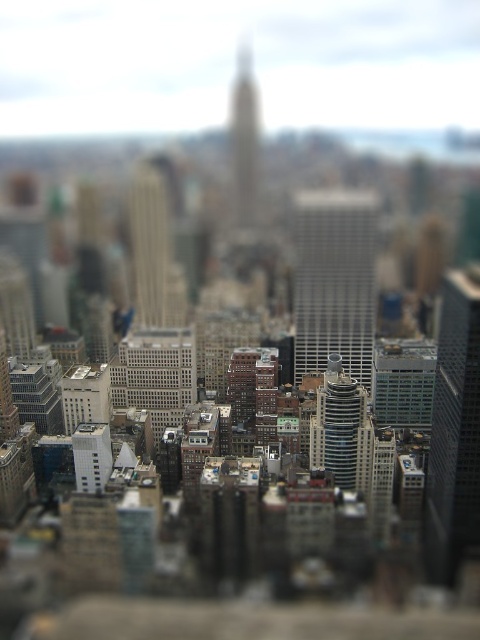
Question: Does silver metallic skyscraper at center appear on the left side of shiny silver skyscraper at center?

Choices:
 (A) no
 (B) yes

Answer: (B)

Question: Estimate the real-world distances between objects in this image. Which object is farther from the shiny silver skyscraper at center?

Choices:
 (A) smooth glass skyscraper at center
 (B) silver metallic skyscraper at center
 (C) glassy skyscraper at right
 (D) white matte building at center

Answer: (A)

Question: Estimate the real-world distances between objects in this image. Which object is farther from the smooth glass skyscraper at center?

Choices:
 (A) shiny silver skyscraper at center
 (B) white matte building at center

Answer: (B)

Question: Does silver metallic skyscraper at center appear on the right side of shiny silver skyscraper at center?

Choices:
 (A) no
 (B) yes

Answer: (A)

Question: Estimate the real-world distances between objects in this image. Which object is farther from the smooth glass skyscraper at center?

Choices:
 (A) glassy skyscraper at right
 (B) silver metallic skyscraper at center
 (C) shiny silver skyscraper at center

Answer: (A)

Question: Is glassy skyscraper at right behind smooth glass skyscraper at center?

Choices:
 (A) yes
 (B) no

Answer: (A)